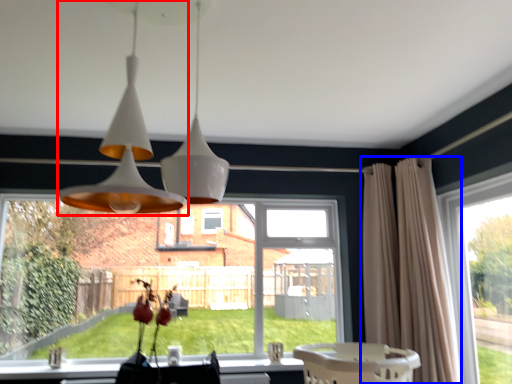
Question: Which object is further to the camera taking this photo, lamp (highlighted by a red box) or curtain (highlighted by a blue box)?

Choices:
 (A) lamp
 (B) curtain

Answer: (B)